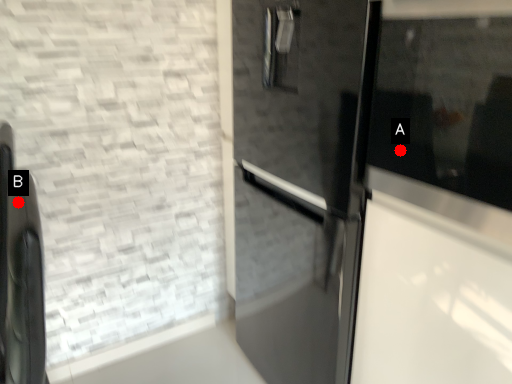
Question: Two points are circled on the image, labeled by A and B beside each circle. Which point is farther from the camera taking this photo?

Choices:
 (A) A is further
 (B) B is further

Answer: (B)